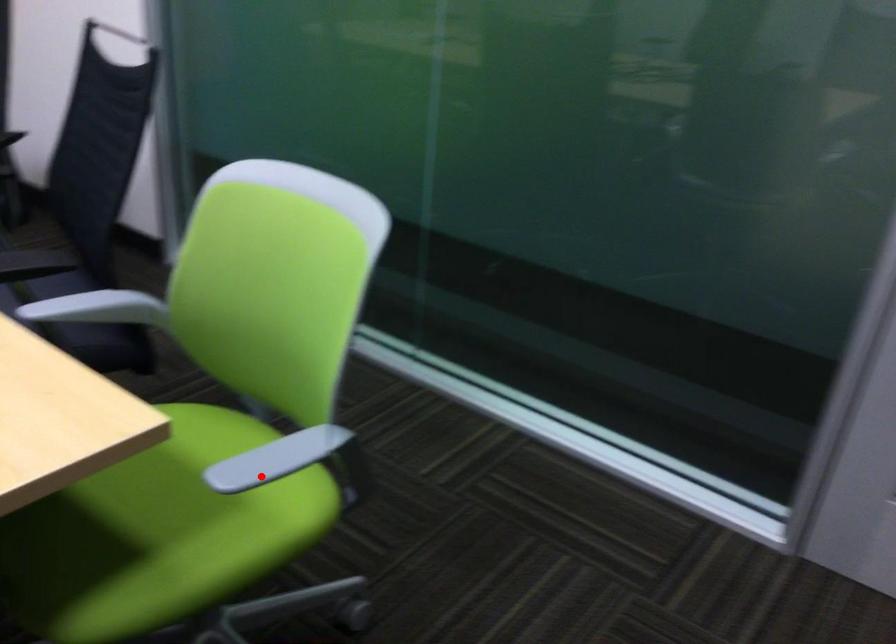
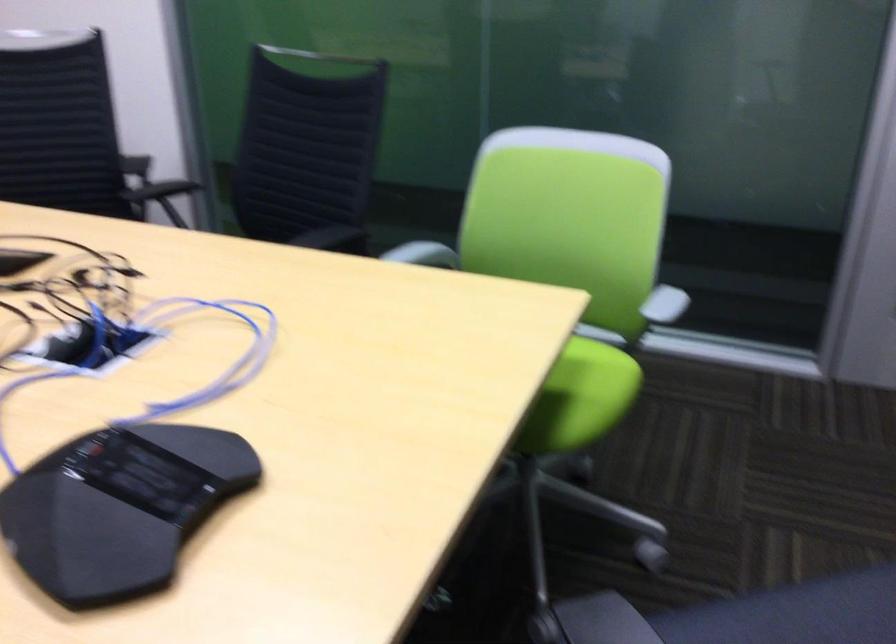
Locate, in the second image, the point that corresponds to the highlighted location in the first image.

(659, 310)